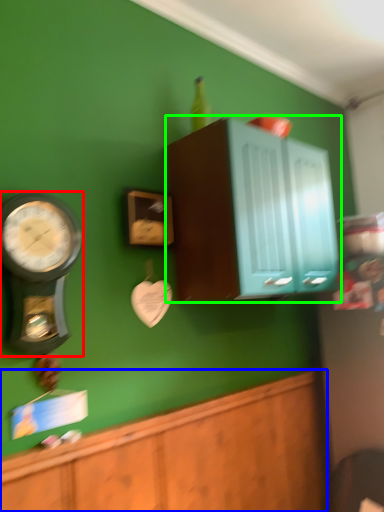
Question: Which is nearer to the wall clock (highlighted by a red box)? cabinetry (highlighted by a blue box) or cabinetry (highlighted by a green box).

Choices:
 (A) cabinetry
 (B) cabinetry

Answer: (A)